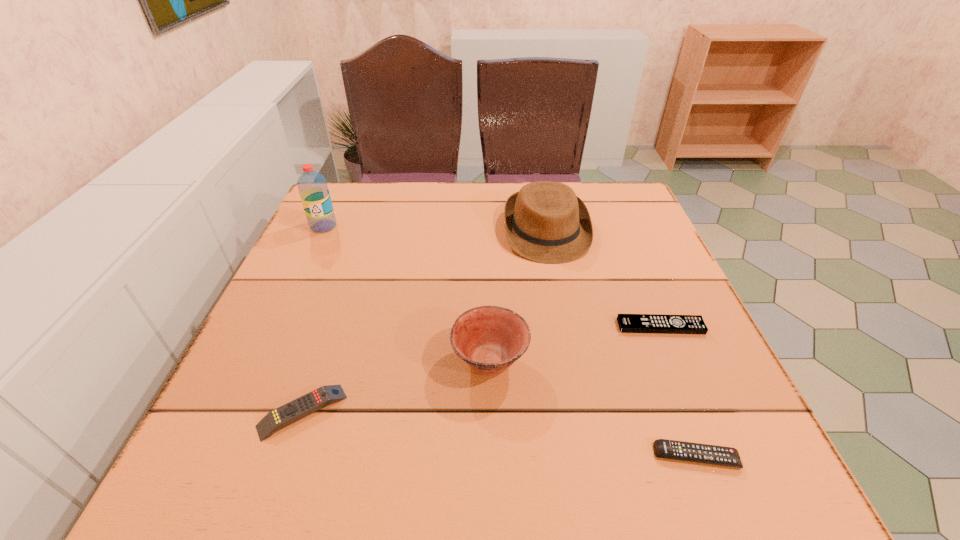
Identify the location of blank region between the nearest object and the fedora. Image resolution: width=960 pixels, height=540 pixels. (621, 343).

The image size is (960, 540). What are the coordinates of `free space between the third tallest object and the water bottle` in the screenshot? It's located at (407, 293).

Where is `free space that is in between the nearest object and the fifth shortest object`? This screenshot has height=540, width=960. free space that is in between the nearest object and the fifth shortest object is located at coordinates (621, 343).

This screenshot has width=960, height=540. Find the location of `free space between the water bottle and the fifth shortest object`. free space between the water bottle and the fifth shortest object is located at coordinates (435, 228).

The width and height of the screenshot is (960, 540). I want to click on free space between the third shortest object and the nearest remote control, so click(x=499, y=434).

You are a GUI agent. You are given a task and a screenshot of the screen. Output one action in this format:
    pyautogui.click(x=<x>, y=<y>)
    Task: Click on the fifth closest object to the bowl
    This screenshot has height=540, width=960.
    Given the screenshot: What is the action you would take?
    pyautogui.click(x=312, y=186)

Find the location of a particular element. This screenshot has height=540, width=960. the second closest object to the leftmost remote control is located at coordinates (545, 222).

I want to click on remote control that is the third closest to the fourth shortest object, so click(x=669, y=449).

The height and width of the screenshot is (540, 960). I want to click on remote control that is the closest one to the water bottle, so click(307, 404).

I want to click on vacant space that satisfies the following two spatial constraints: 1. on the front label of the tallest object; 2. on the left side of the nearest object, so click(x=216, y=456).